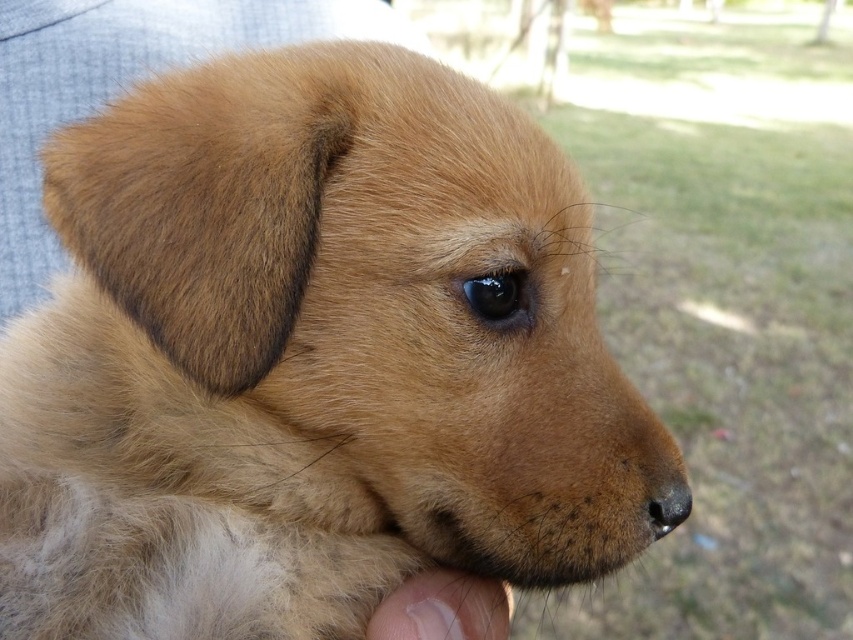
Question: Is white skin at lower center to the left of brown matte nose at lower center from the viewer's perspective?

Choices:
 (A) yes
 (B) no

Answer: (A)

Question: Which point appears closest to the camera in this image?

Choices:
 (A) (497, 625)
 (B) (675, 484)

Answer: (B)

Question: Which of the following is the closest to the observer?

Choices:
 (A) (480, 637)
 (B) (666, 499)

Answer: (B)

Question: Is white skin at lower center below brown matte nose at lower center?

Choices:
 (A) yes
 (B) no

Answer: (A)

Question: Can you confirm if white skin at lower center is positioned to the right of brown matte nose at lower center?

Choices:
 (A) yes
 (B) no

Answer: (B)